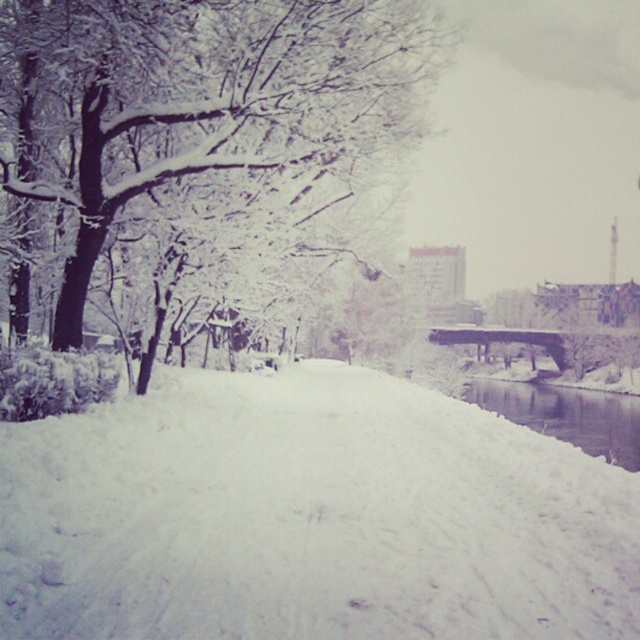
You are standing at the edge of the snowy area and want to reach the clear water at lower right without stepping on the white fluffy snow at center. Is there a path available that avoids the snow?

The white fluffy snow at center is in front of clear water at lower right, so there is no visible path that avoids stepping on the white fluffy snow at center to reach the clear water at lower right.